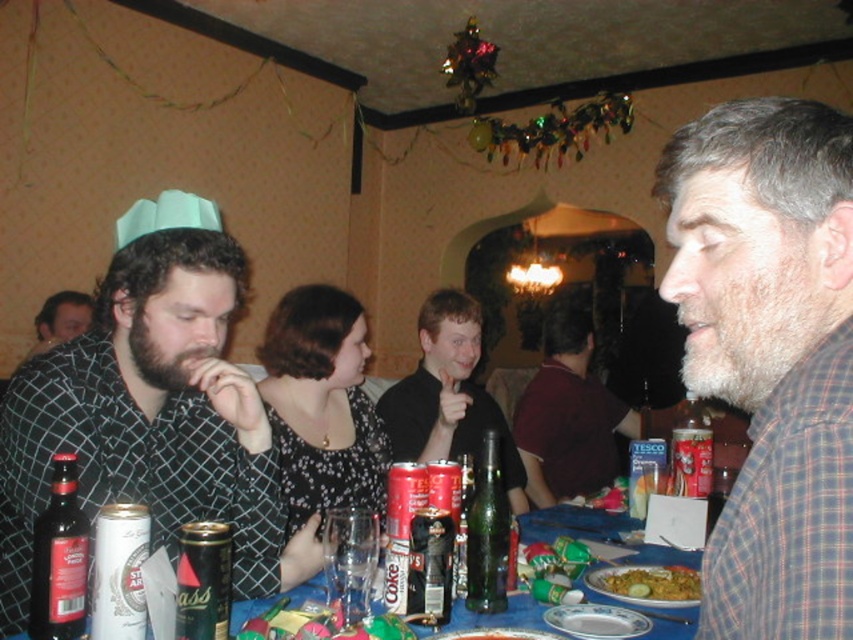
Question: Is metallic green can at table center thinner than metallic can at table center?

Choices:
 (A) no
 (B) yes

Answer: (A)

Question: Does glassy plastic bottle at center appear under metallic green can at table center?

Choices:
 (A) no
 (B) yes

Answer: (B)

Question: Which point is farther from the camera taking this photo?

Choices:
 (A) (482, 536)
 (B) (442, 580)
 (C) (521, 595)
 (D) (68, 541)

Answer: (C)

Question: Which object is farther from the camera taking this photo?

Choices:
 (A) dark brown glass bottle at lower left
 (B) gray flannel shirt at center

Answer: (A)

Question: Does glassy plastic bottle at center have a lesser width compared to green glass bottle at center?

Choices:
 (A) yes
 (B) no

Answer: (B)

Question: Which of the following is the closest to the observer?

Choices:
 (A) metallic can at table center
 (B) dark gray checkered shirt at left
 (C) yellow rice at table center

Answer: (A)